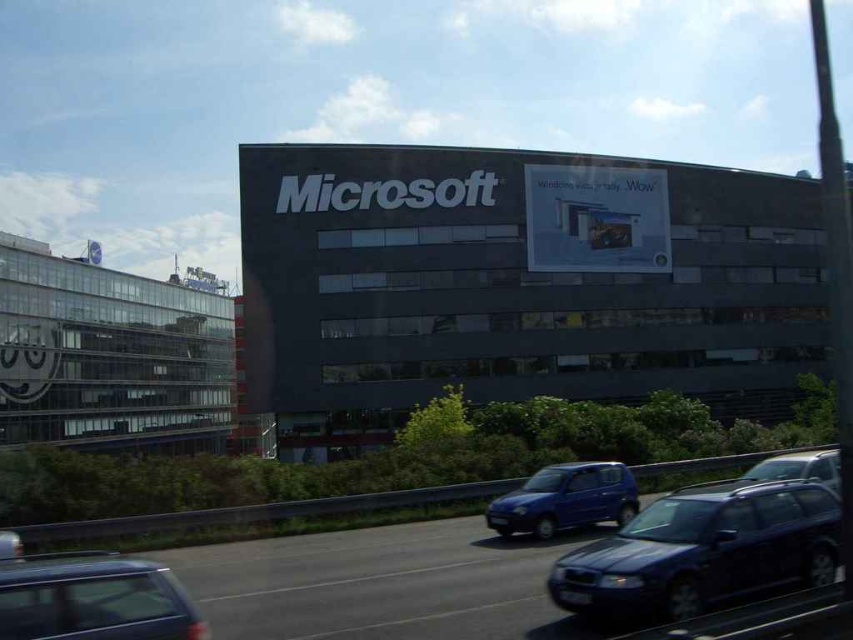
You are a delivery driver needing to park your truck between the matte black car at lower left and the matte blue hatchback at center. Can your truck fit in the space between them?

The matte black car at lower left is smaller than the matte blue hatchback at center, so the space between them may vary depending on their exact positions. However, since the truck size isn not specified, it is unclear if it can fit.

You are standing in front of the Microsoft building and want to take a photo. There are two points marked on the building facade at coordinates point (120, 628) and point (827, 458). Which point will appear larger in your camera view?

Point (120, 628) is closer to the camera than point (827, 458), so it will appear larger in the camera view.

You are a delivery person trying to park your 1.8 meters tall delivery cart between the matte black car at lower left and the metallic silver car at center. Can your cart fit vertically between them?

The matte black car at lower left is shorter than the metallic silver car at center, so the vertical space between them would depend on the height difference. Since the cart is 1.8 meters tall, and the cars have different heights, the cart should fit as long as the lower height of the taller car minus the height of the shorter car is at least 1.8 meters. However, without exact measurements, it is uncertain. But according to the description, the matte black car is shorter, so the space between them might be